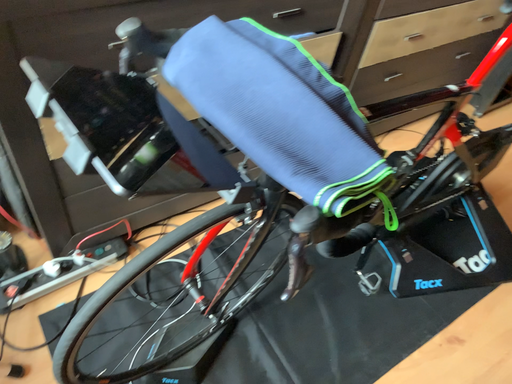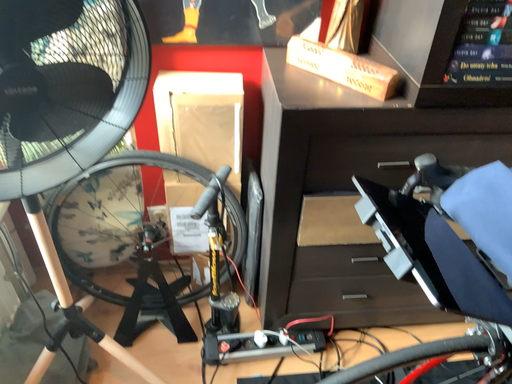
Question: How did the camera likely rotate when shooting the video?

Choices:
 (A) rotated downward
 (B) rotated upward

Answer: (B)